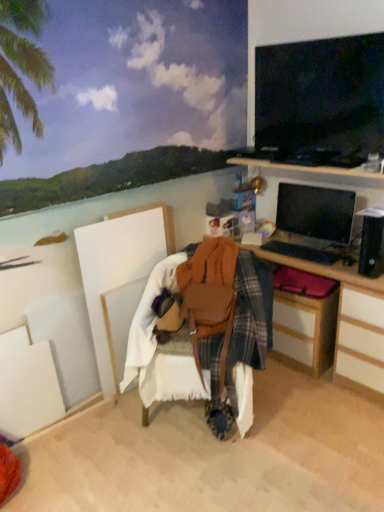
Question: Is wooden desk at center looking in the opposite direction of matte black monitor at right?

Choices:
 (A) yes
 (B) no

Answer: (B)

Question: Does wooden desk at center have a greater width compared to matte black monitor at right?

Choices:
 (A) no
 (B) yes

Answer: (B)

Question: Is wooden desk at center outside matte black monitor at right?

Choices:
 (A) no
 (B) yes

Answer: (B)

Question: Can you confirm if wooden desk at center is positioned to the left of matte black monitor at right?

Choices:
 (A) no
 (B) yes

Answer: (B)

Question: Could matte black monitor at right be considered to be inside wooden desk at center?

Choices:
 (A) yes
 (B) no

Answer: (B)

Question: Would you say wooden desk at center is a long distance from matte black monitor at right?

Choices:
 (A) yes
 (B) no

Answer: (B)

Question: From a real-world perspective, is plaid fabric drawer at right positioned over matte black monitor at right based on gravity?

Choices:
 (A) yes
 (B) no

Answer: (B)

Question: Does plaid fabric drawer at right appear on the left side of matte black monitor at right?

Choices:
 (A) no
 (B) yes

Answer: (B)

Question: Considering the relative sizes of plaid fabric drawer at right and matte black monitor at right in the image provided, is plaid fabric drawer at right shorter than matte black monitor at right?

Choices:
 (A) yes
 (B) no

Answer: (B)

Question: Is plaid fabric drawer at right looking in the opposite direction of matte black monitor at right?

Choices:
 (A) no
 (B) yes

Answer: (A)

Question: Does plaid fabric drawer at right contain matte black monitor at right?

Choices:
 (A) no
 (B) yes

Answer: (A)

Question: From a real-world perspective, is plaid fabric drawer at right located beneath matte black monitor at right?

Choices:
 (A) yes
 (B) no

Answer: (A)

Question: Is matte black monitor at right looking in the opposite direction of wooden desk at center?

Choices:
 (A) no
 (B) yes

Answer: (A)